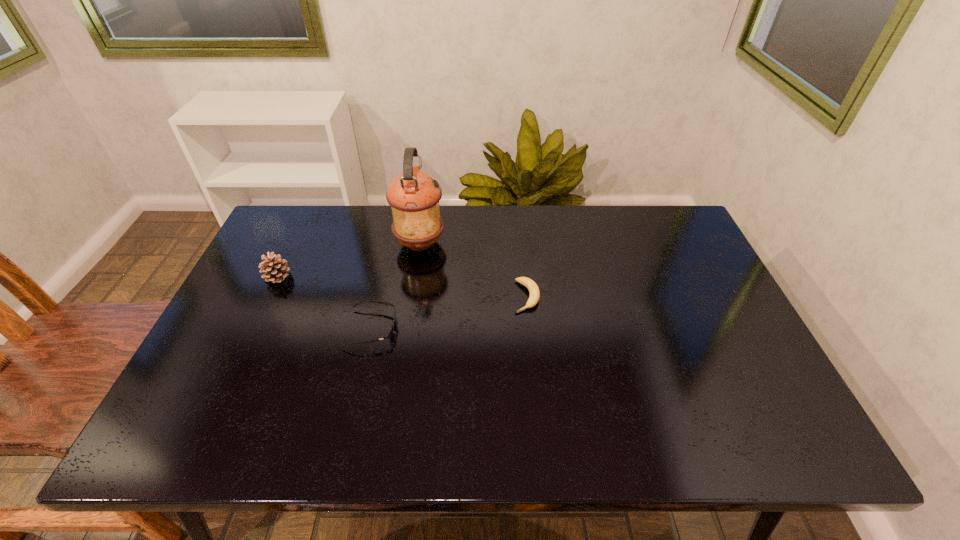
At what (x,y) coordinates should I click in order to perform the action: click on free space between the second shortest object and the banana. Please return your answer as a coordinate pair (x, y). Looking at the image, I should click on (449, 312).

Locate an element on the screen. Image resolution: width=960 pixels, height=540 pixels. empty location between the third tallest object and the shortest object is located at coordinates (449, 312).

You are a GUI agent. You are given a task and a screenshot of the screen. Output one action in this format:
    pyautogui.click(x=<x>, y=<y>)
    Task: Click on the unoccupied area between the oil lamp and the leftmost object
    
    Given the screenshot: What is the action you would take?
    pyautogui.click(x=349, y=260)

This screenshot has width=960, height=540. Identify the location of empty space between the banana and the pinecone. (x=402, y=287).

Where is `vacant space in between the banana and the third tallest object`? This screenshot has height=540, width=960. vacant space in between the banana and the third tallest object is located at coordinates (449, 312).

Where is `free space between the second shortest object and the banana`? The image size is (960, 540). free space between the second shortest object and the banana is located at coordinates (449, 312).

The width and height of the screenshot is (960, 540). Find the location of `free space that is in between the third tallest object and the leftmost object`. free space that is in between the third tallest object and the leftmost object is located at coordinates (325, 302).

Find the location of `free spot between the oil lamp and the third tallest object`. free spot between the oil lamp and the third tallest object is located at coordinates (396, 286).

The width and height of the screenshot is (960, 540). Identify the location of free space that is in between the sunglasses and the leftmost object. (325, 302).

Identify the location of vacant space in between the shortest object and the tallest object. The width and height of the screenshot is (960, 540). (473, 270).